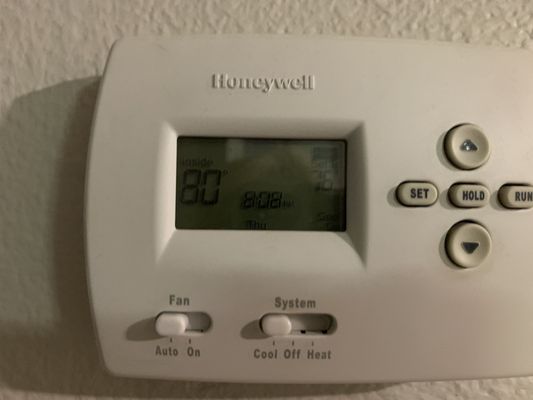
What are the coordinates of `thermostat` in the screenshot? It's located at (132, 169).